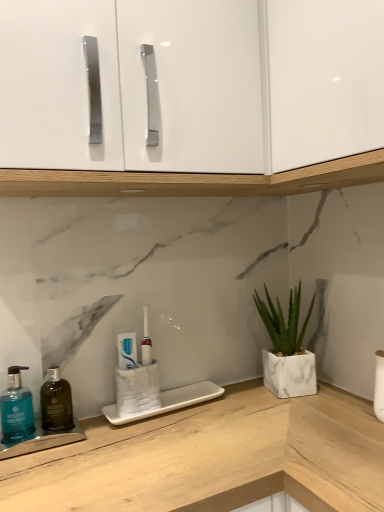
Question: Is white marble planter at right in front of or behind white glossy toothpaste at center in the image?

Choices:
 (A) behind
 (B) front

Answer: (A)

Question: From a real-world perspective, is white marble planter at right above or below white glossy toothpaste at center?

Choices:
 (A) below
 (B) above

Answer: (A)

Question: Considering the real-world distances, which object is farthest from the white glossy cabinet doors at upper center?

Choices:
 (A) white glossy toothpaste at center
 (B) teal matte soap dispenser at lower left
 (C) dark green glass mouthwash at left
 (D) white marble planter at right

Answer: (B)

Question: Considering the real-world distances, which object is farthest from the white marble planter at right?

Choices:
 (A) dark green glass mouthwash at left
 (B) white glossy cabinet doors at upper center
 (C) teal matte soap dispenser at lower left
 (D) white glossy toothpaste at center

Answer: (C)